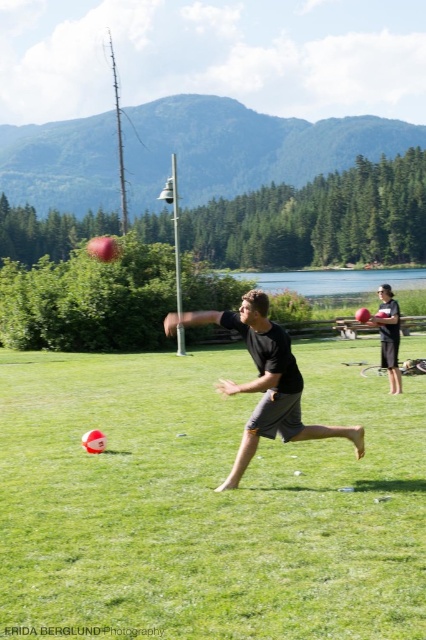
Question: Is black matte shirt at center to the left of matte black shorts at center from the viewer's perspective?

Choices:
 (A) no
 (B) yes

Answer: (B)

Question: Can you confirm if green grassy field at center is positioned above matte black shorts at center?

Choices:
 (A) yes
 (B) no

Answer: (B)

Question: Among these objects, which one is nearest to the camera?

Choices:
 (A) black matte shirt at center
 (B) green grassy field at center
 (C) matte black shorts at center

Answer: (B)

Question: Which of the following is the closest to the observer?

Choices:
 (A) (299, 390)
 (B) (31, 376)
 (C) (397, 317)

Answer: (A)

Question: Is green grassy field at center wider than black matte shirt at center?

Choices:
 (A) no
 (B) yes

Answer: (B)

Question: Which of the following is the farthest from the observer?

Choices:
 (A) black matte shirt at center
 (B) matte black shorts at center
 (C) green grassy field at center

Answer: (B)